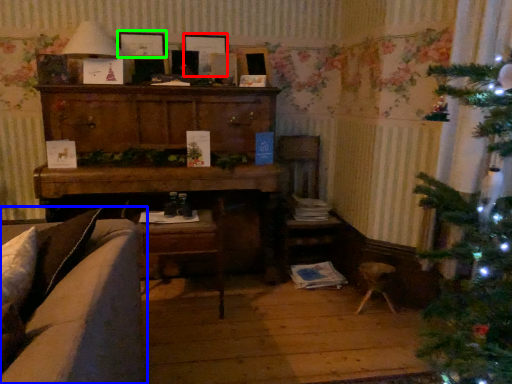
Question: Which object is the closest to the picture frame (highlighted by a red box)? Choose among these: studio couch (highlighted by a blue box) or picture frame (highlighted by a green box).

Choices:
 (A) studio couch
 (B) picture frame

Answer: (B)